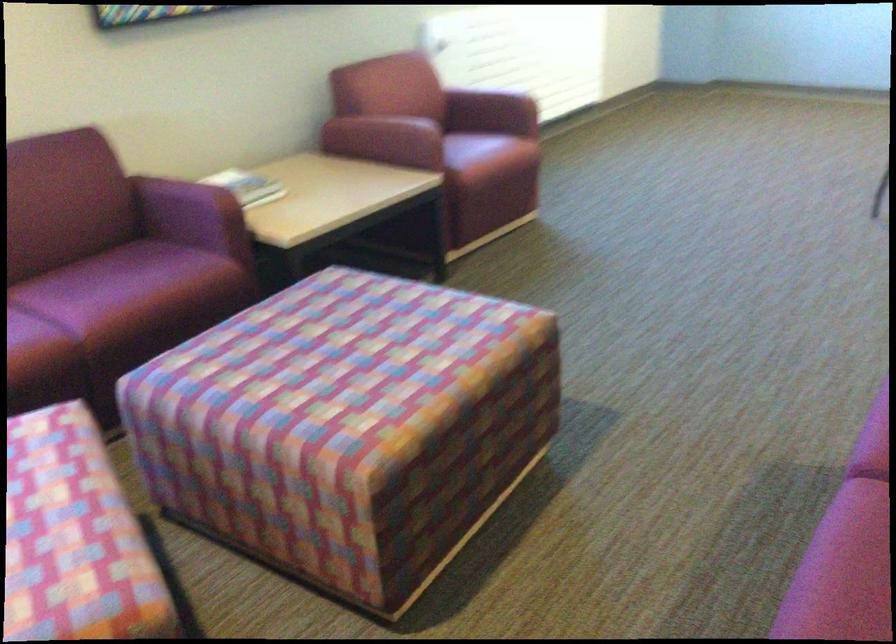
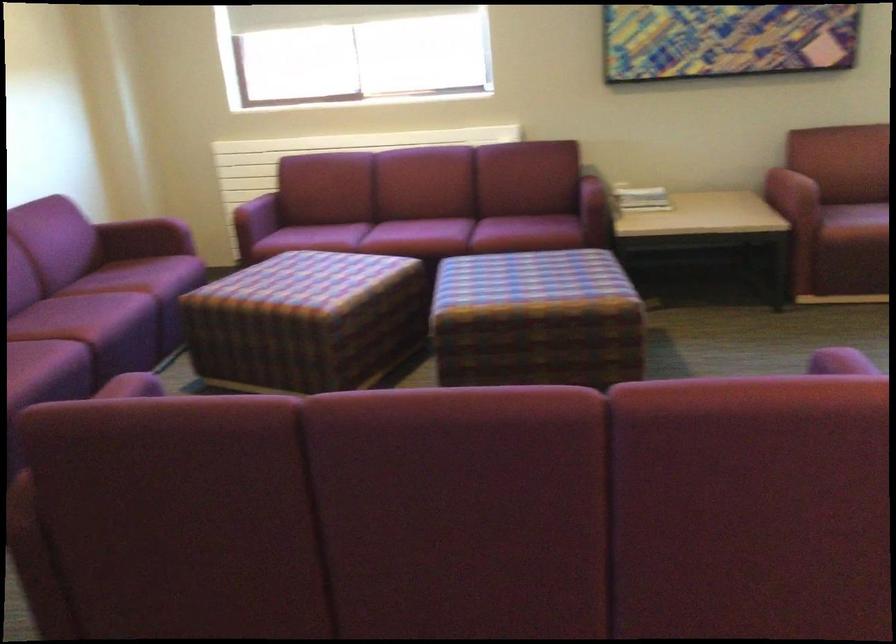
In the second image, find the point that corresponds to (x=133, y=190) in the first image.

(596, 178)